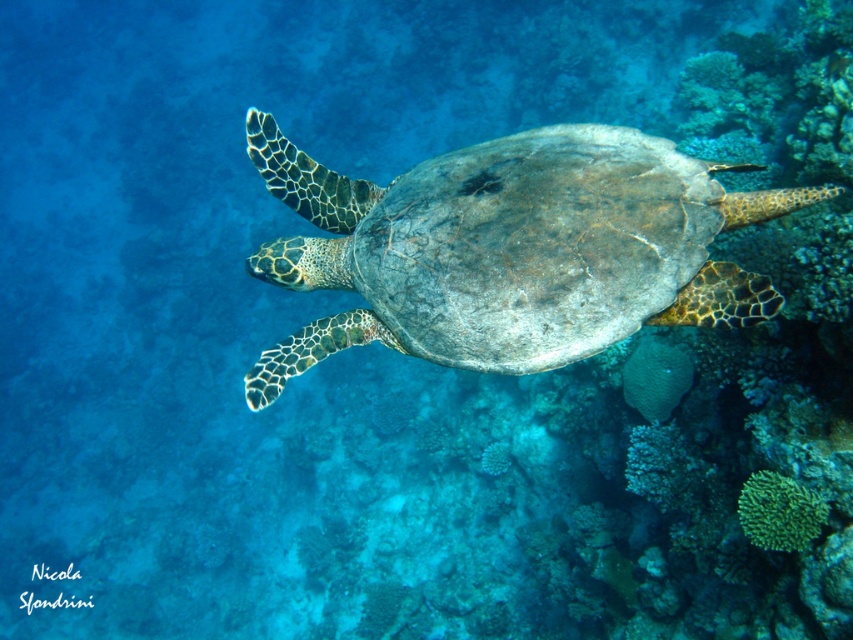
Question: Does leathery greenish-brown turtle at center lie behind green matte coral at lower right?

Choices:
 (A) yes
 (B) no

Answer: (B)

Question: Which object appears closest to the camera in this image?

Choices:
 (A) leathery greenish-brown turtle at center
 (B) green matte coral at lower right

Answer: (A)

Question: Does leathery greenish-brown turtle at center have a lesser width compared to green matte coral at lower right?

Choices:
 (A) yes
 (B) no

Answer: (B)

Question: Which object is closer to the camera taking this photo?

Choices:
 (A) leathery greenish-brown turtle at center
 (B) green matte coral at lower right

Answer: (A)

Question: Is leathery greenish-brown turtle at center positioned in front of green matte coral at lower right?

Choices:
 (A) yes
 (B) no

Answer: (A)